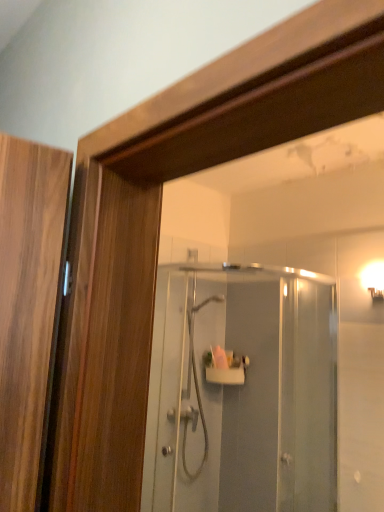
Question: Can you confirm if clear glass shower door at center is shorter than white glossy wall sconce at upper right?

Choices:
 (A) no
 (B) yes

Answer: (A)

Question: From the image's perspective, would you say clear glass shower door at center is positioned over white glossy wall sconce at upper right?

Choices:
 (A) yes
 (B) no

Answer: (B)

Question: Is clear glass shower door at center oriented away from white glossy wall sconce at upper right?

Choices:
 (A) yes
 (B) no

Answer: (B)

Question: From a real-world perspective, is clear glass shower door at center located higher than white glossy wall sconce at upper right?

Choices:
 (A) yes
 (B) no

Answer: (B)

Question: From a real-world perspective, is clear glass shower door at center positioned under white glossy wall sconce at upper right based on gravity?

Choices:
 (A) no
 (B) yes

Answer: (B)

Question: Based on their positions, is white glossy shower at center located to the left or right of white glossy wall sconce at upper right?

Choices:
 (A) left
 (B) right

Answer: (A)

Question: Relative to white glossy wall sconce at upper right, is white glossy shower at center in front or behind?

Choices:
 (A) front
 (B) behind

Answer: (B)

Question: Is white glossy shower at center inside the boundaries of white glossy wall sconce at upper right, or outside?

Choices:
 (A) outside
 (B) inside

Answer: (A)

Question: Considering the positions of white glossy shower at center and white glossy wall sconce at upper right in the image, is white glossy shower at center taller or shorter than white glossy wall sconce at upper right?

Choices:
 (A) tall
 (B) short

Answer: (A)

Question: In the image, is clear glass shower door at center positioned in front of or behind white glossy wall sconce at upper right?

Choices:
 (A) behind
 (B) front

Answer: (B)

Question: Considering the positions of point (271, 458) and point (374, 262), is point (271, 458) closer or farther from the camera than point (374, 262)?

Choices:
 (A) closer
 (B) farther

Answer: (B)

Question: In terms of width, does clear glass shower door at center look wider or thinner when compared to white glossy wall sconce at upper right?

Choices:
 (A) thin
 (B) wide

Answer: (B)

Question: Looking at the image, does clear glass shower door at center seem bigger or smaller compared to white glossy wall sconce at upper right?

Choices:
 (A) big
 (B) small

Answer: (A)

Question: In the image, is clear glass shower door at center on the left side or the right side of white glossy shower at center?

Choices:
 (A) left
 (B) right

Answer: (B)

Question: Do you think clear glass shower door at center is within white glossy shower at center, or outside of it?

Choices:
 (A) outside
 (B) inside

Answer: (A)